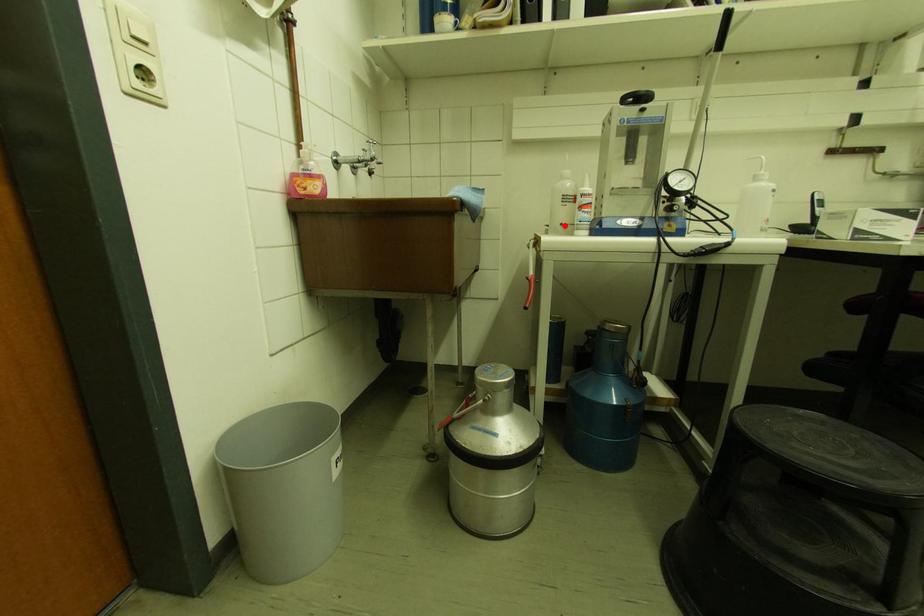
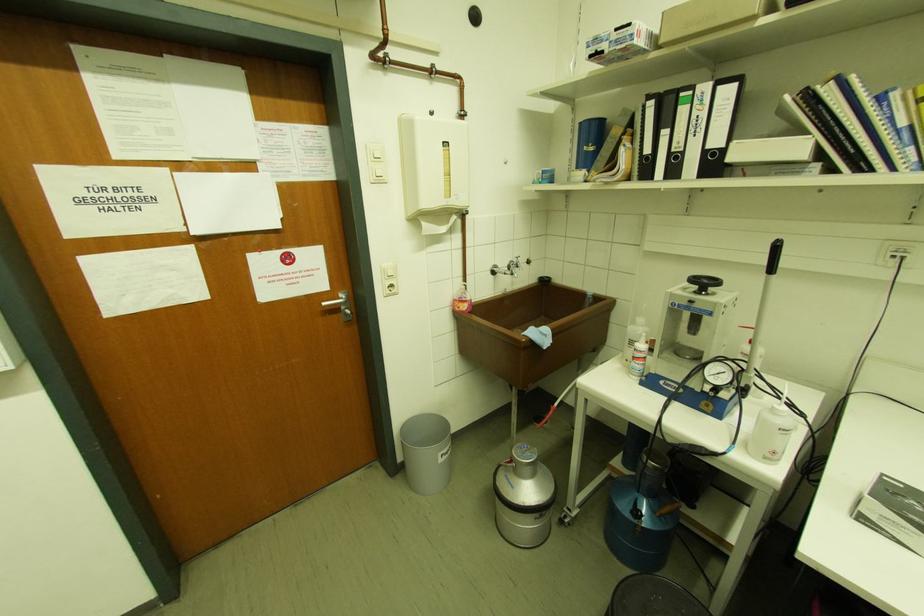
Question: I am providing you with two images of the same scene from different viewpoints. In image1, a red point is highlighted. Considering the same 3D point in image2, which of the following is correct?

Choices:
 (A) It is closer
 (B) It is farther

Answer: (A)